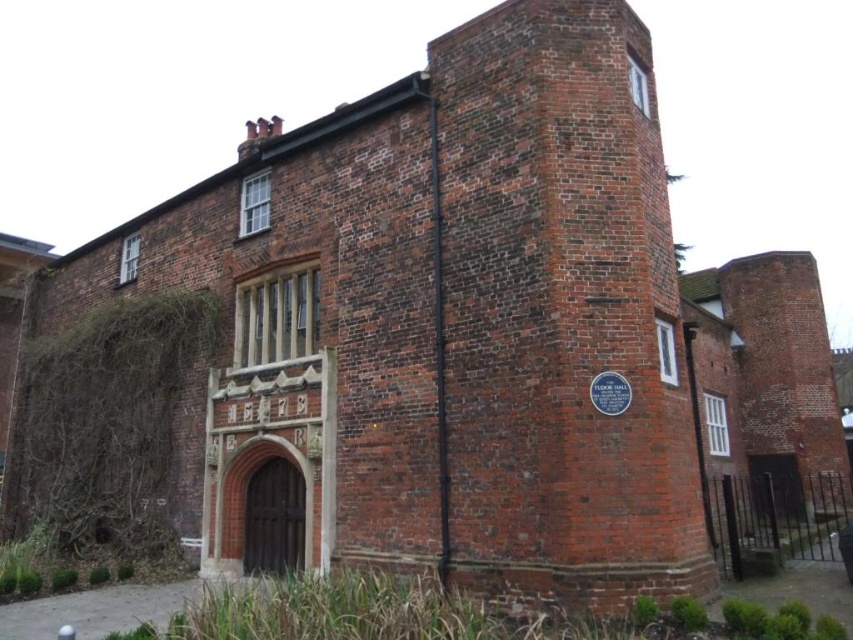
You are an architect analyzing Tudor Hall. You notice the green leafy ivy at left and the white plastic clock at upper right. Which object is smaller in size?

The green leafy ivy at left is smaller in size compared to the white plastic clock at upper right.

You are standing in front of Tudor Hall and want to take a photo. You notice two points marked on the building. The first point is at coordinates point [119,372] and the second is at point [643,84]. Which point is closer to your camera when taking the photo?

Point [119,372] is closer to the camera than point [643,84] because it is further to the camera than the other point.

Based on the scene description, where is the green leafy ivy at left in relation to the white plastic clock at upper right?

The green leafy ivy at left is to the left of the white plastic clock at upper right.